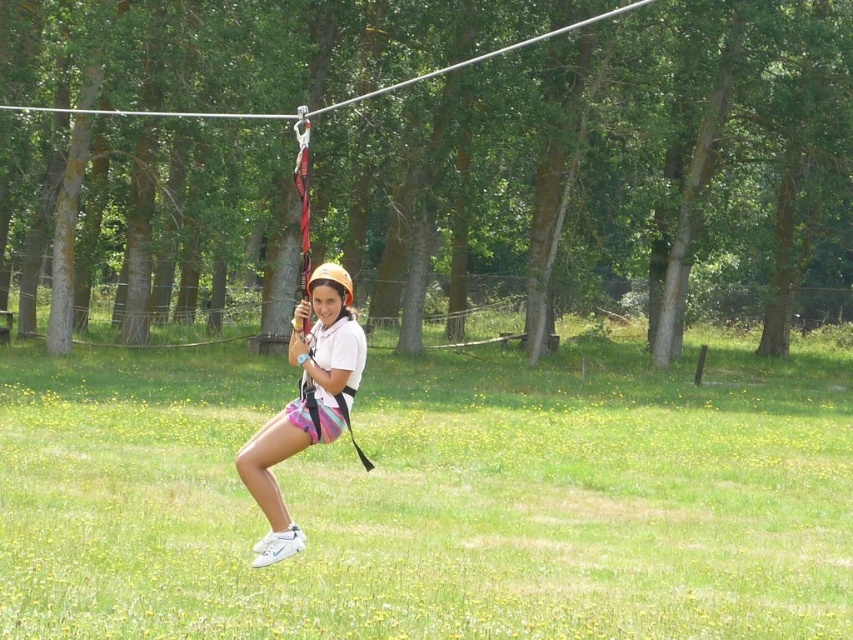
Is brown wood tree at center to the left of white matte helmet at center from the viewer's perspective?

No, brown wood tree at center is not to the left of white matte helmet at center.

Which is above, brown wood tree at center or white matte helmet at center?

brown wood tree at center is above.

At what (x,y) coordinates should I click in order to perform the action: click on brown wood tree at center. Please return your answer as a coordinate pair (x, y). Image resolution: width=853 pixels, height=640 pixels. Looking at the image, I should click on (433, 154).

Locate an element on the screen. This screenshot has width=853, height=640. brown wood tree at center is located at coordinates (433, 154).

Does brown wood tree at center appear on the left side of green grassy field at center?

In fact, brown wood tree at center is to the right of green grassy field at center.

Does brown wood tree at center have a larger size compared to green grassy field at center?

Correct, brown wood tree at center is larger in size than green grassy field at center.

Image resolution: width=853 pixels, height=640 pixels. In order to click on brown wood tree at center in this screenshot , I will do tap(433, 154).

Does green grassy field at center have a smaller size compared to white matte helmet at center?

Actually, green grassy field at center might be larger than white matte helmet at center.

Which is below, green grassy field at center or white matte helmet at center?

green grassy field at center is below.

The image size is (853, 640). I want to click on green grassy field at center, so click(430, 499).